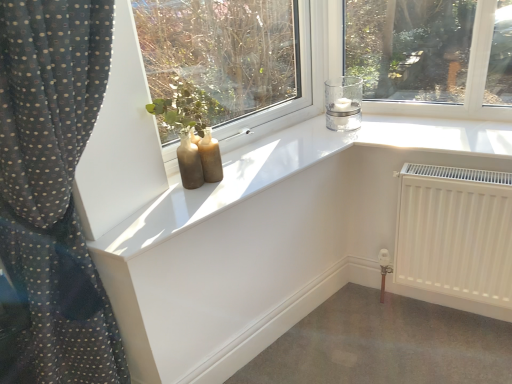
Image resolution: width=512 pixels, height=384 pixels. I want to click on clear glass candle at upper right, so click(343, 103).

The width and height of the screenshot is (512, 384). I want to click on clear glass candle at upper right, so click(343, 103).

Considering the relative sizes of clear glass candle at upper right and white matte radiator at lower right in the image provided, is clear glass candle at upper right bigger than white matte radiator at lower right?

Actually, clear glass candle at upper right might be smaller than white matte radiator at lower right.

Which of these two, clear glass candle at upper right or white matte radiator at lower right, is wider?

Wider between the two is clear glass candle at upper right.

What's the angular difference between clear glass candle at upper right and white matte radiator at lower right's facing directions?

The facing directions of clear glass candle at upper right and white matte radiator at lower right are 1.07 degrees apart.

Is white matte radiator at lower right a part of clear glass candle at upper right?

No, white matte radiator at lower right is not a part of clear glass candle at upper right.

Find the location of `radiator on the right of matte glass bottles at center`. radiator on the right of matte glass bottles at center is located at coordinates (455, 233).

In the image, is white matte radiator at lower right positioned in front of or behind matte glass bottles at center?

→ white matte radiator at lower right is behind matte glass bottles at center.

Is white matte radiator at lower right oriented away from matte glass bottles at center?

That's not correct — white matte radiator at lower right is not looking away from matte glass bottles at center.

Who is bigger, matte glass bottles at center or clear glass candle at upper right?

Bigger between the two is matte glass bottles at center.

Can you confirm if matte glass bottles at center is taller than clear glass candle at upper right?

Correct, matte glass bottles at center is much taller as clear glass candle at upper right.

Is matte glass bottles at center facing away from clear glass candle at upper right?

matte glass bottles at center does not have its back to clear glass candle at upper right.

Which of these two, matte glass bottles at center or clear glass candle at upper right, is wider?

With larger width is clear glass candle at upper right.

From the image's perspective, is matte glass bottles at center on white matte radiator at lower right?

Correct, matte glass bottles at center appears higher than white matte radiator at lower right in the image.

Is matte glass bottles at center positioned beyond the bounds of white matte radiator at lower right?

Absolutely, matte glass bottles at center is external to white matte radiator at lower right.

Considering the relative sizes of matte glass bottles at center and white matte radiator at lower right in the image provided, is matte glass bottles at center taller than white matte radiator at lower right?

In fact, matte glass bottles at center may be shorter than white matte radiator at lower right.

Is point (279, 68) more distant than point (464, 188)?

Yes, point (279, 68) is behind point (464, 188).

Is clear glass candle at upper right positioned far away from matte glass bottles at center?

clear glass candle at upper right is positioned a significant distance from matte glass bottles at center.

Considering the relative sizes of clear glass candle at upper right and matte glass bottles at center in the image provided, is clear glass candle at upper right wider than matte glass bottles at center?

Indeed, clear glass candle at upper right has a greater width compared to matte glass bottles at center.

What are the coordinates of `candle holder below the matte glass bottles at center (from the image's perspective)` in the screenshot? It's located at (343, 103).

Does clear glass candle at upper right appear on the left side of matte glass bottles at center?

No.

Is white matte radiator at lower right wider or thinner than clear glass candle at upper right?

white matte radiator at lower right is thinner than clear glass candle at upper right.

Would you say white matte radiator at lower right is inside or outside clear glass candle at upper right?

white matte radiator at lower right is spatially situated outside clear glass candle at upper right.

Is white matte radiator at lower right turned away from clear glass candle at upper right?

No, white matte radiator at lower right is not facing the opposite direction of clear glass candle at upper right.

Is white matte radiator at lower right behind clear glass candle at upper right?

No, white matte radiator at lower right is in front of clear glass candle at upper right.

Where is `candle holder on the left of white matte radiator at lower right`? This screenshot has height=384, width=512. candle holder on the left of white matte radiator at lower right is located at coordinates [343, 103].

You are a GUI agent. You are given a task and a screenshot of the screen. Output one action in this format:
    pyautogui.click(x=<x>, y=<y>)
    Task: Click on the radiator below the matte glass bottles at center (from the image's perspective)
    The width and height of the screenshot is (512, 384).
    Given the screenshot: What is the action you would take?
    pyautogui.click(x=455, y=233)

From the image, which object appears to be farther from white matte radiator at lower right, clear glass candle at upper right or matte glass bottles at center?

matte glass bottles at center lies further to white matte radiator at lower right than the other object.

Estimate the real-world distances between objects in this image. Which object is closer to clear glass candle at upper right, white matte radiator at lower right or matte glass bottles at center?

white matte radiator at lower right lies closer to clear glass candle at upper right than the other object.

Considering their positions, is white matte radiator at lower right positioned further to matte glass bottles at center than clear glass candle at upper right?

The object further to matte glass bottles at center is white matte radiator at lower right.

Considering their positions, is clear glass candle at upper right positioned further to matte glass bottles at center than white matte radiator at lower right?

The object further to matte glass bottles at center is white matte radiator at lower right.

When comparing their distances from clear glass candle at upper right, does matte glass bottles at center or white matte radiator at lower right seem further?

matte glass bottles at center lies further to clear glass candle at upper right than the other object.

Considering their positions, is matte glass bottles at center positioned further to white matte radiator at lower right than clear glass candle at upper right?

matte glass bottles at center is further to white matte radiator at lower right.

This screenshot has width=512, height=384. Identify the location of candle holder between matte glass bottles at center and white matte radiator at lower right in the horizontal direction. (343, 103).